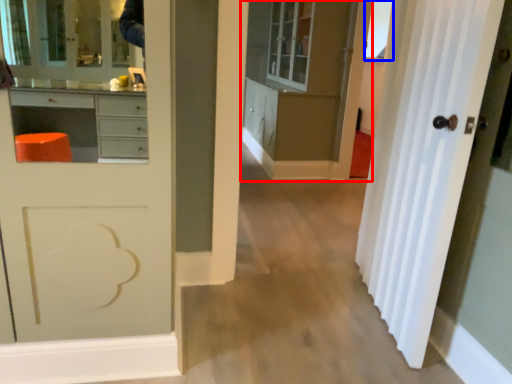
Question: Which of the following is the farthest to the observer, cabinetry (highlighted by a red box) or window (highlighted by a blue box)?

Choices:
 (A) cabinetry
 (B) window

Answer: (B)